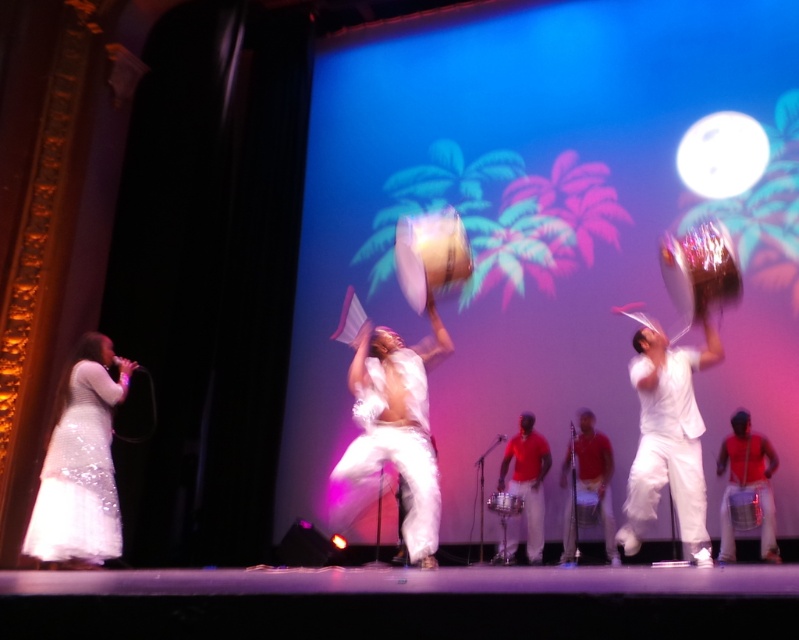
Between white sequined dress at left and shiny red drum at right, which one has more height?

Standing taller between the two is shiny red drum at right.

At what (x,y) coordinates should I click in order to perform the action: click on white sequined dress at left. Please return your answer as a coordinate pair (x, y). Looking at the image, I should click on (78, 474).

You are a GUI agent. You are given a task and a screenshot of the screen. Output one action in this format:
    pyautogui.click(x=<x>, y=<y>)
    Task: Click on the white sequined dress at left
    
    Given the screenshot: What is the action you would take?
    pyautogui.click(x=78, y=474)

Who is positioned more to the right, white matte drum at center or white sequined dress at left?

white matte drum at center

Does white matte drum at center have a lesser width compared to white sequined dress at left?

No, white matte drum at center is not thinner than white sequined dress at left.

This screenshot has height=640, width=799. What do you see at coordinates (392, 429) in the screenshot?
I see `white matte drum at center` at bounding box center [392, 429].

This screenshot has width=799, height=640. What are the coordinates of `white matte drum at center` in the screenshot? It's located at (392, 429).

Can you confirm if white sequined dress at left is bigger than red cotton shirt at center?

Yes, white sequined dress at left is bigger than red cotton shirt at center.

Is white sequined dress at left to the right of red cotton shirt at center from the viewer's perspective?

No, white sequined dress at left is not to the right of red cotton shirt at center.

The width and height of the screenshot is (799, 640). Find the location of `white sequined dress at left`. white sequined dress at left is located at coordinates (78, 474).

The image size is (799, 640). I want to click on white sequined dress at left, so click(x=78, y=474).